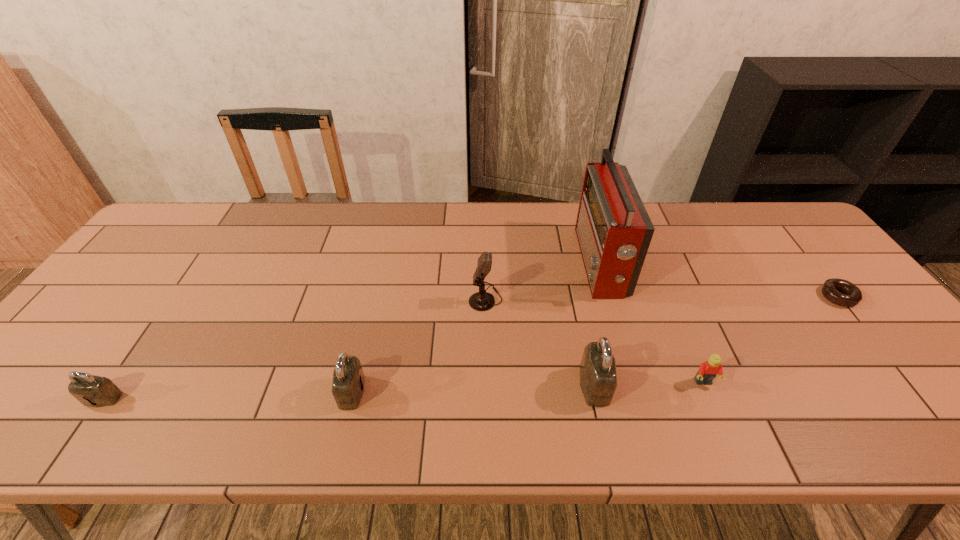
You are a GUI agent. You are given a task and a screenshot of the screen. Output one action in this format:
    pyautogui.click(x=<x>, y=<y>)
    Task: Click on the free area in between the tallest object and the leftmost padlock
    The height and width of the screenshot is (540, 960).
    Given the screenshot: What is the action you would take?
    tap(351, 331)

This screenshot has width=960, height=540. Identify the location of vacant space in between the sixth object from right to left and the tallest object. (476, 327).

The image size is (960, 540). I want to click on free point between the fifth object from right to left and the fifth object from left to right, so click(543, 281).

This screenshot has height=540, width=960. I want to click on empty space between the second object from right to left and the fifth object from left to right, so click(x=652, y=323).

The width and height of the screenshot is (960, 540). Find the location of `vacant space that's between the sixth object from right to left and the second object from right to left`. vacant space that's between the sixth object from right to left and the second object from right to left is located at coordinates (528, 387).

Identify the location of vacant space that is in between the leftmost object and the microphone. This screenshot has width=960, height=540. (295, 349).

You are a GUI agent. You are given a task and a screenshot of the screen. Output one action in this format:
    pyautogui.click(x=<x>, y=<y>)
    Task: Click on the vacant space that is in between the radio receiver and the second tallest padlock
    This screenshot has width=960, height=540.
    Given the screenshot: What is the action you would take?
    pyautogui.click(x=476, y=327)

Where is `vacant point located between the sixth object from left to right and the fourth shortest object`? vacant point located between the sixth object from left to right and the fourth shortest object is located at coordinates (528, 387).

The width and height of the screenshot is (960, 540). In order to click on free point between the second object from right to left and the fourth object from left to right in this screenshot , I will do `click(649, 384)`.

At what (x,y) coordinates should I click in order to perform the action: click on object that is the third nearest to the fourth object from left to right. Please return your answer as a coordinate pair (x, y). Looking at the image, I should click on (481, 301).